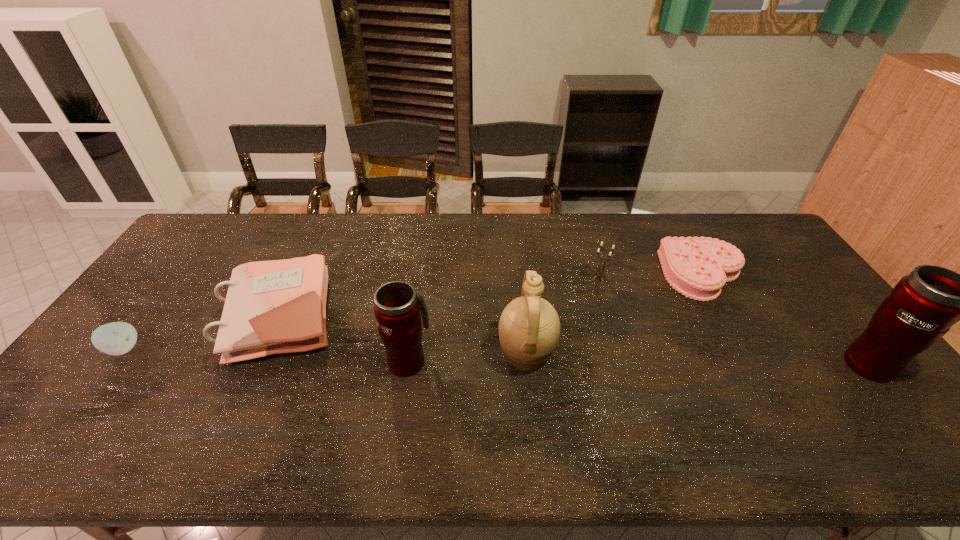
This screenshot has width=960, height=540. I want to click on free space located 0.320m on the front of the cake, so click(x=769, y=393).

In order to click on free spot located on the right of the leftmost object in this screenshot , I will do `click(194, 349)`.

Locate an element on the screen. The image size is (960, 540). object that is positioned at the far edge is located at coordinates (697, 267).

Locate an element on the screen. The height and width of the screenshot is (540, 960). object at the left edge is located at coordinates (116, 338).

The width and height of the screenshot is (960, 540). I want to click on object present at the right edge, so click(x=923, y=306).

Identify the location of blank space at the far edge of the desktop. The height and width of the screenshot is (540, 960). (522, 235).

At what (x,y) coordinates should I click in order to perform the action: click on blank space at the near edge of the desktop. Please return your answer as a coordinate pair (x, y). This screenshot has width=960, height=540. Looking at the image, I should click on (732, 395).

Find the location of `free space at the left edge of the desktop`. free space at the left edge of the desktop is located at coordinates (166, 311).

Locate an element on the screen. This screenshot has height=540, width=960. free space at the right edge of the desktop is located at coordinates (767, 298).

Locate an element on the screen. free region at the near right corner is located at coordinates (903, 403).